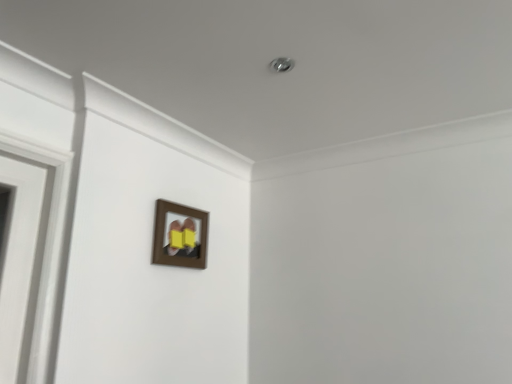
What is the approximate height of wooden frame at upper center?

wooden frame at upper center is 29.84 centimeters in height.

Describe the element at coordinates (180, 236) in the screenshot. I see `wooden frame at upper center` at that location.

Locate an element on the screen. wooden frame at upper center is located at coordinates (180, 236).

Where is `wooden frame at upper center`? The height and width of the screenshot is (384, 512). wooden frame at upper center is located at coordinates (180, 236).